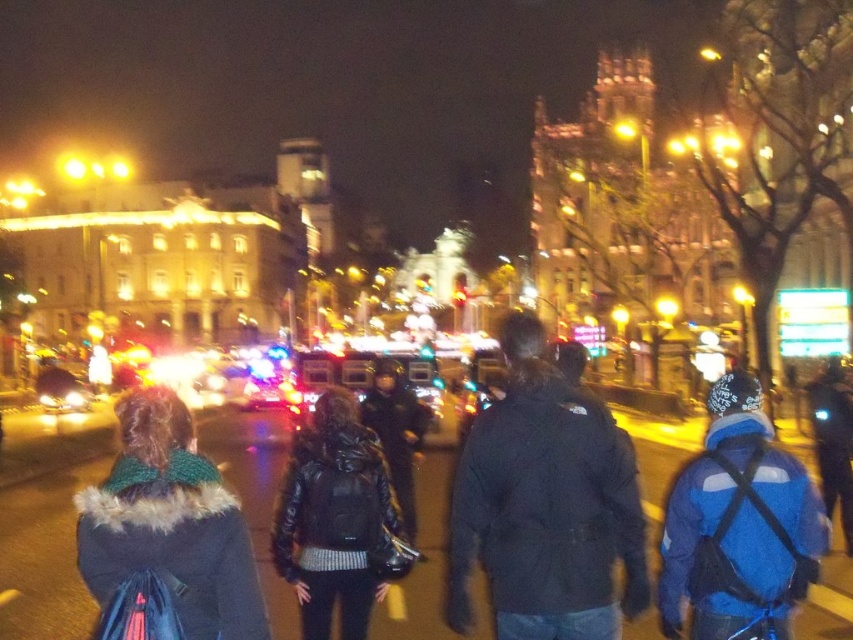
You are a photographer standing at the edge of the city square, and you want to take a photo that includes both the black matte jacket at center and the black leather jacket at center. What is the minimum distance you need to move backward to ensure both jackets are in frame?

The black matte jacket at center and black leather jacket at center are 13.61 meters apart from each other. To capture both in the frame, you need to move backward until your camera can cover at least 13.61 meters horizontally. The exact distance depends on your camera lens, but generally, moving back to a position where the entire 13.61 meters between them fits within your field of view would be required.

You are a photographer trying to capture both the black matte jacket at center and the fuzzy green scarf at lower left in the same frame. Which object should you zoom out to include first?

The black matte jacket at center is bigger than the fuzzy green scarf at lower left, so you should zoom out to include the black matte jacket at center first to ensure it fits in the frame.

You are a photographer trying to capture both the blue matte jacket at lower right and the fuzzy green scarf at lower left in the same frame. Since your camera has a fixed focus, which object should you prioritize to ensure it appears clearer in the photo?

The blue matte jacket at lower right should be prioritized because it is narrower than the fuzzy green scarf at lower left, making it easier to fit within the camera focus area.